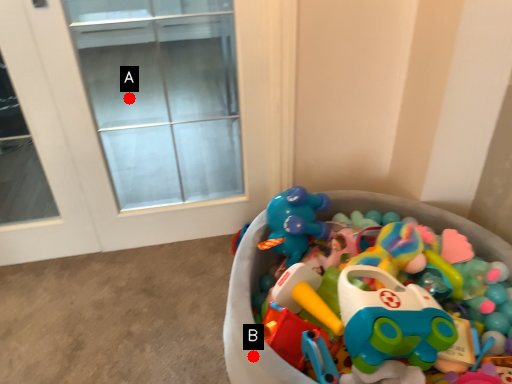
Question: Two points are circled on the image, labeled by A and B beside each circle. Which point is farther from the camera taking this photo?

Choices:
 (A) A is further
 (B) B is further

Answer: (A)